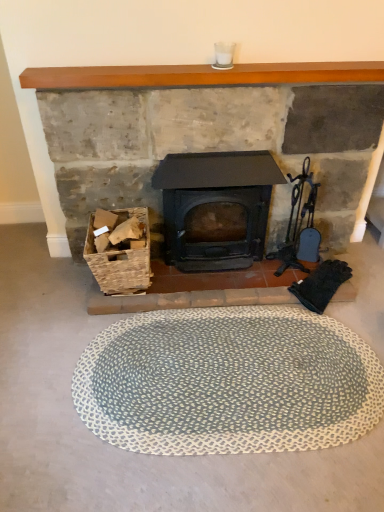
Question: Considering the relative positions of blue textured bath mat at center and matte black wood burning stove at center in the image provided, is blue textured bath mat at center to the right of matte black wood burning stove at center from the viewer's perspective?

Choices:
 (A) no
 (B) yes

Answer: (B)

Question: Is blue textured bath mat at center bigger than matte black wood burning stove at center?

Choices:
 (A) no
 (B) yes

Answer: (A)

Question: Is the depth of blue textured bath mat at center less than that of matte black wood burning stove at center?

Choices:
 (A) yes
 (B) no

Answer: (A)

Question: Is blue textured bath mat at center facing away from matte black wood burning stove at center?

Choices:
 (A) yes
 (B) no

Answer: (B)

Question: From a real-world perspective, does blue textured bath mat at center stand above matte black wood burning stove at center?

Choices:
 (A) no
 (B) yes

Answer: (A)

Question: Is there a large distance between blue textured bath mat at center and matte black wood burning stove at center?

Choices:
 (A) no
 (B) yes

Answer: (A)

Question: Is wooden mantlepiece at upper center located outside woven wood basket at lower left?

Choices:
 (A) yes
 (B) no

Answer: (A)

Question: Does wooden mantlepiece at upper center have a greater height compared to woven wood basket at lower left?

Choices:
 (A) yes
 (B) no

Answer: (B)

Question: Does wooden mantlepiece at upper center have a smaller size compared to woven wood basket at lower left?

Choices:
 (A) yes
 (B) no

Answer: (A)

Question: Is wooden mantlepiece at upper center touching woven wood basket at lower left?

Choices:
 (A) no
 (B) yes

Answer: (A)

Question: From a real-world perspective, is wooden mantlepiece at upper center located higher than woven wood basket at lower left?

Choices:
 (A) no
 (B) yes

Answer: (B)

Question: Is woven wood basket at lower left at the back of wooden mantlepiece at upper center?

Choices:
 (A) no
 (B) yes

Answer: (A)

Question: Can you confirm if woven wood basket at lower left is thinner than matte black wood burning stove at center?

Choices:
 (A) no
 (B) yes

Answer: (A)